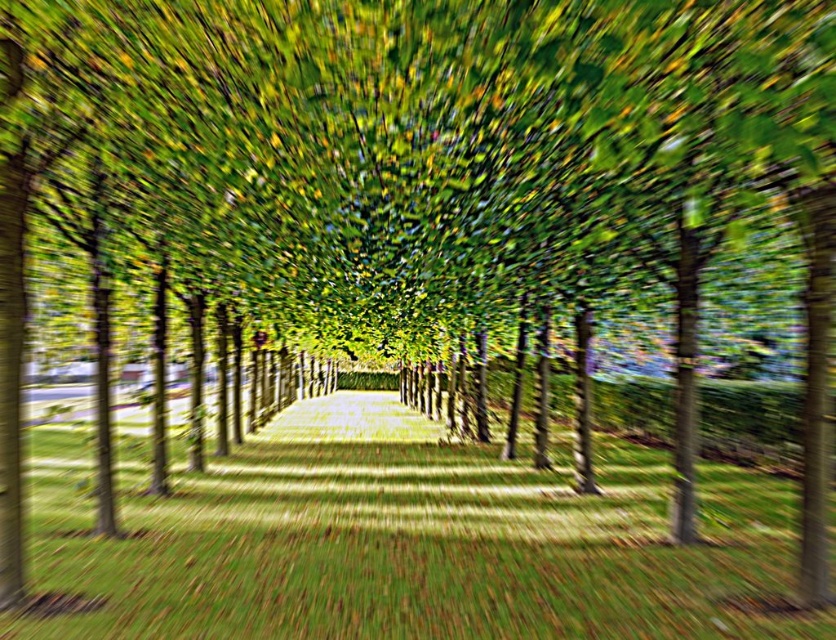
Question: Which point is farther to the camera?

Choices:
 (A) (398, 412)
 (B) (607, 580)

Answer: (A)

Question: Is green grass at center closer to the viewer compared to green leafy canopy at center?

Choices:
 (A) yes
 (B) no

Answer: (A)

Question: Is green grass at center thinner than green leafy canopy at center?

Choices:
 (A) no
 (B) yes

Answer: (A)

Question: Is green grass at center further to camera compared to green leafy canopy at center?

Choices:
 (A) no
 (B) yes

Answer: (A)

Question: Which point is farther from the camera taking this photo?

Choices:
 (A) (370, 419)
 (B) (342, 392)

Answer: (B)

Question: Which point is farther to the camera?

Choices:
 (A) (492, 637)
 (B) (344, 422)

Answer: (B)